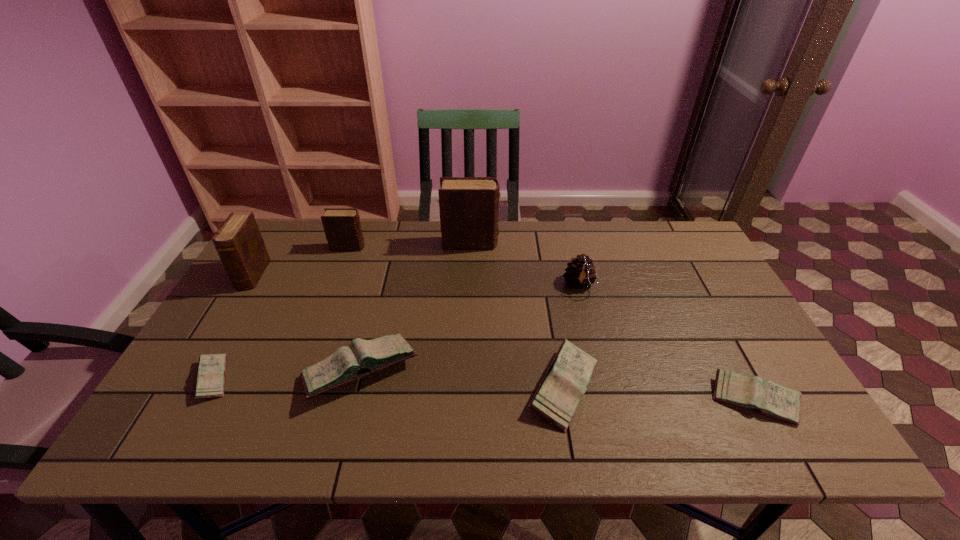
Where is `vacant space located on the right of the second pink diary from left to right`? The image size is (960, 540). vacant space located on the right of the second pink diary from left to right is located at coordinates (541, 370).

The width and height of the screenshot is (960, 540). In order to click on vacant region located 0.090m on the right of the third shortest diary in this screenshot , I will do `click(641, 387)`.

This screenshot has width=960, height=540. Identify the location of blank area located 0.250m on the back of the rightmost object. (702, 303).

Identify the location of vacant space positioned 0.190m on the right of the shortest diary. The height and width of the screenshot is (540, 960). (312, 379).

In order to click on object that is at the right edge in this screenshot , I will do `click(753, 393)`.

Find the location of a particular element. The image size is (960, 540). object located in the far left corner section of the desktop is located at coordinates tap(238, 241).

At what (x,y) coordinates should I click in order to perform the action: click on object that is at the near right corner. Please return your answer as a coordinate pair (x, y). Looking at the image, I should click on (753, 393).

This screenshot has width=960, height=540. Find the location of `vacant space at the far edge of the desktop`. vacant space at the far edge of the desktop is located at coordinates (403, 248).

You are a GUI agent. You are given a task and a screenshot of the screen. Output one action in this format:
    pyautogui.click(x=<x>, y=<y>)
    Task: Click on the vacant region at the right edge
    The width and height of the screenshot is (960, 540).
    Given the screenshot: What is the action you would take?
    pyautogui.click(x=693, y=271)

Locate an element on the screen. free space at the far left corner of the desktop is located at coordinates (275, 251).